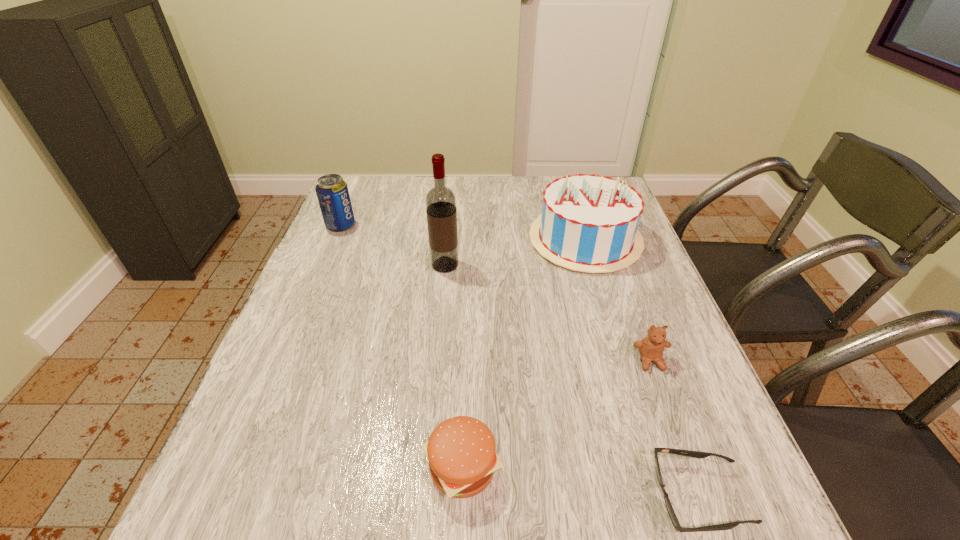
Point out which object is positioned as the nearest to the shortest object. Please provide its 2D coordinates. Your answer should be formatted as a tuple, i.e. [(x, y)], where the tuple contains the x and y coordinates of a point satisfying the conditions above.

[(651, 348)]